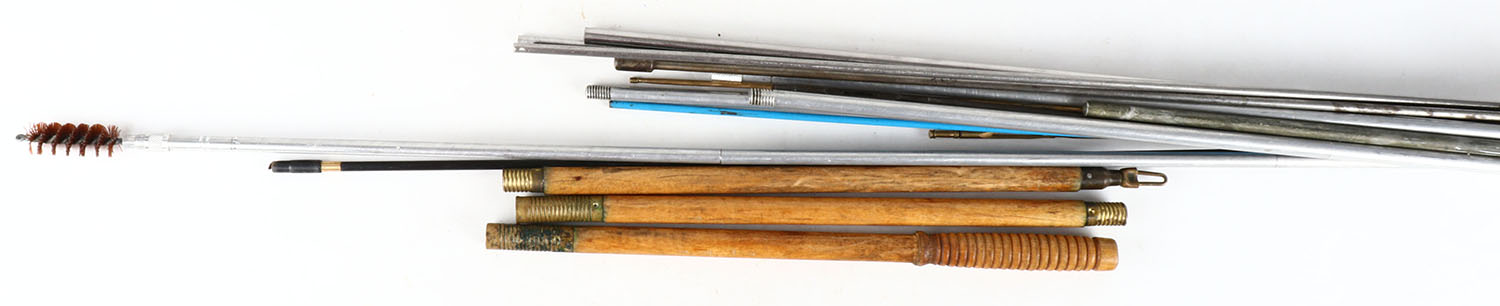
The height and width of the screenshot is (306, 1500). In order to click on hook in this screenshot , I will do `click(1146, 175)`.